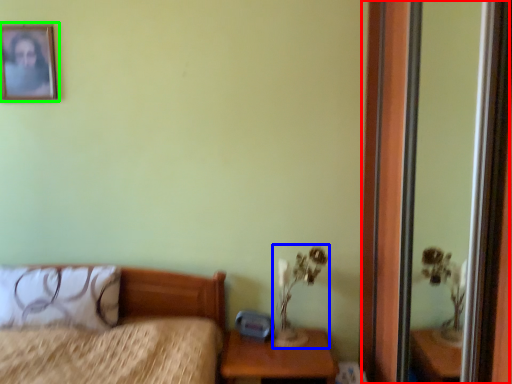
Question: Estimate the real-world distances between objects in this image. Which object is farther from screen door (highlighted by a red box), table lamp (highlighted by a blue box) or picture frame (highlighted by a green box)?

Choices:
 (A) table lamp
 (B) picture frame

Answer: (B)